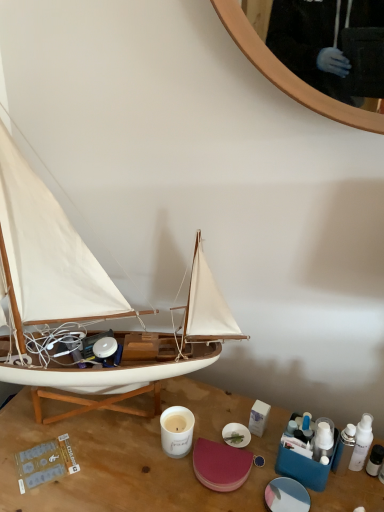
Question: Is the surface of wooden sailboat at left in direct contact with wooden desk at center?

Choices:
 (A) no
 (B) yes

Answer: (A)

Question: Is wooden sailboat at left to the left of wooden desk at center from the viewer's perspective?

Choices:
 (A) yes
 (B) no

Answer: (A)

Question: Does wooden sailboat at left come behind wooden desk at center?

Choices:
 (A) yes
 (B) no

Answer: (B)

Question: Is wooden sailboat at left shorter than wooden desk at center?

Choices:
 (A) yes
 (B) no

Answer: (B)

Question: Considering the relative sizes of wooden sailboat at left and wooden desk at center in the image provided, is wooden sailboat at left taller than wooden desk at center?

Choices:
 (A) no
 (B) yes

Answer: (B)

Question: Does wooden sailboat at left have a smaller size compared to wooden desk at center?

Choices:
 (A) yes
 (B) no

Answer: (A)

Question: Does wooden desk at center have a smaller size compared to wooden sailboat at left?

Choices:
 (A) yes
 (B) no

Answer: (B)

Question: Is wooden desk at center surrounding wooden sailboat at left?

Choices:
 (A) yes
 (B) no

Answer: (B)

Question: Can you confirm if wooden desk at center is positioned to the right of wooden sailboat at left?

Choices:
 (A) yes
 (B) no

Answer: (A)

Question: Can we say wooden desk at center lies outside wooden sailboat at left?

Choices:
 (A) yes
 (B) no

Answer: (A)

Question: Considering the relative sizes of wooden desk at center and wooden sailboat at left in the image provided, is wooden desk at center shorter than wooden sailboat at left?

Choices:
 (A) no
 (B) yes

Answer: (B)

Question: From the image's perspective, is wooden desk at center on wooden sailboat at left?

Choices:
 (A) yes
 (B) no

Answer: (B)

Question: Is wooden sailboat at left wider or thinner than wooden desk at center?

Choices:
 (A) wide
 (B) thin

Answer: (B)